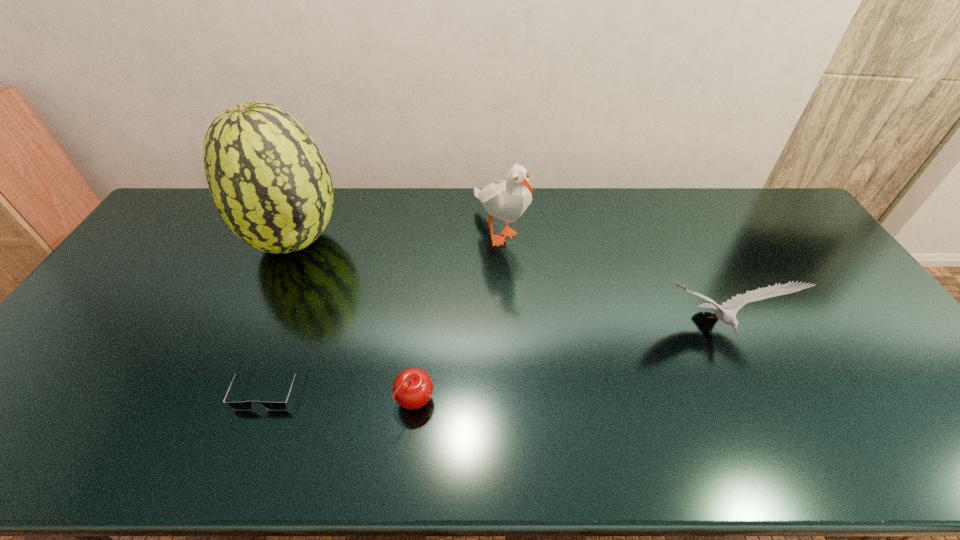
This screenshot has width=960, height=540. In order to click on empty location between the rightmost object and the left gull in this screenshot , I will do `click(608, 279)`.

Where is `vacant space in between the second shortest object and the sunglasses`? vacant space in between the second shortest object and the sunglasses is located at coordinates (342, 394).

Where is `empty space that is in between the taller gull and the right gull`? This screenshot has height=540, width=960. empty space that is in between the taller gull and the right gull is located at coordinates (608, 279).

Where is `free space that is in between the shortest object and the fourth shortest object`? free space that is in between the shortest object and the fourth shortest object is located at coordinates (384, 308).

Find the location of a particular element. The width and height of the screenshot is (960, 540). free spot between the tallest object and the sunglasses is located at coordinates (282, 314).

Where is `vacant area between the watermelon and the shortest object`? vacant area between the watermelon and the shortest object is located at coordinates (282, 314).

You are a GUI agent. You are given a task and a screenshot of the screen. Output one action in this format:
    pyautogui.click(x=<x>, y=<y>)
    Task: Click on the free point between the farther gull and the tallest object
    This screenshot has width=960, height=540.
    Given the screenshot: What is the action you would take?
    pyautogui.click(x=397, y=236)

The image size is (960, 540). In order to click on vacant space that is in between the shortest object and the taller gull in this screenshot , I will do `click(384, 308)`.

The height and width of the screenshot is (540, 960). I want to click on vacant point located between the tallest object and the taller gull, so [397, 236].

Where is `object that stands as the fourth closest to the sunglasses`? The image size is (960, 540). object that stands as the fourth closest to the sunglasses is located at coordinates (728, 316).